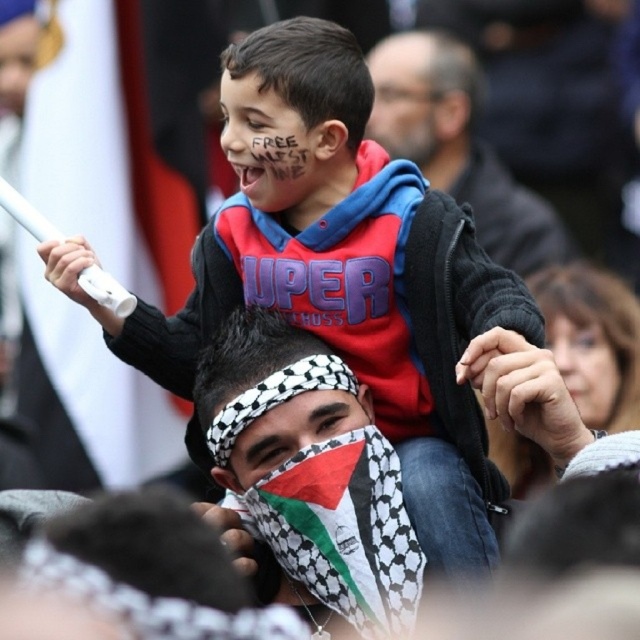
Who is lower down, matte black jacket at upper center or matte red shirt at center?

matte red shirt at center is below.

Between matte black jacket at upper center and matte red shirt at center, which one has more height?

With more height is matte black jacket at upper center.

Between point (563, 253) and point (312, 163), which one is positioned in front?

Point (312, 163) is more forward.

The width and height of the screenshot is (640, 640). In order to click on matte black jacket at upper center in this screenshot , I will do `click(458, 145)`.

Is matte red shirt at center thinner than smooth skin face at upper right?

No, matte red shirt at center is not thinner than smooth skin face at upper right.

Is point (262, 202) farther from camera compared to point (600, 396)?

That is False.

Locate an element on the screen. Image resolution: width=640 pixels, height=640 pixels. matte red shirt at center is located at coordinates (x=273, y=148).

This screenshot has width=640, height=640. I want to click on matte red shirt at center, so click(x=273, y=148).

Is point (417, 328) positioned in front of point (396, 42)?

Yes, point (417, 328) is closer to viewer.

Between point (248, 204) and point (426, 124), which one is positioned in front?

Positioned in front is point (248, 204).

The image size is (640, 640). I want to click on matte red hoodie at upper center, so [x=349, y=291].